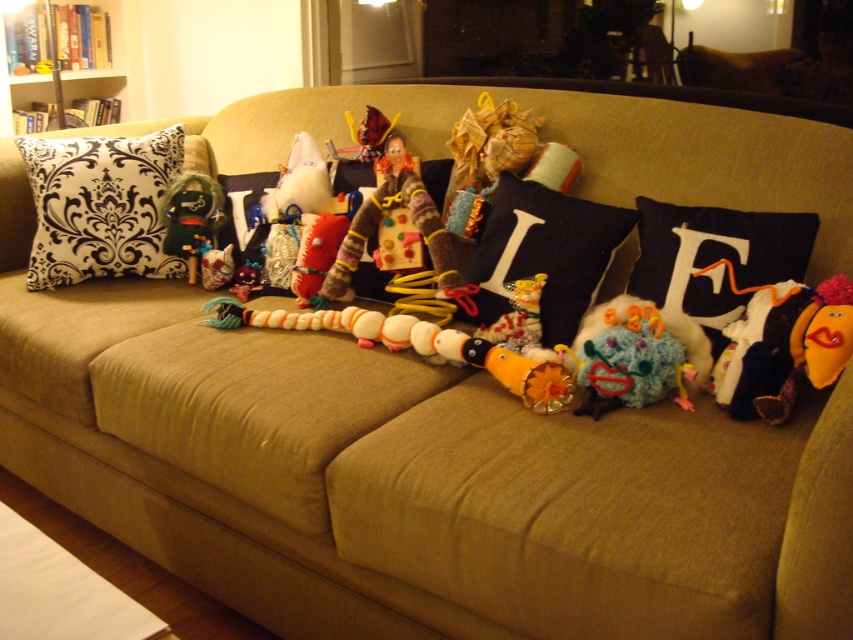
Question: Which point is farther to the camera?

Choices:
 (A) orange plush toy at right
 (B) orange plush toy at center

Answer: (B)

Question: Which object appears farthest from the camera in this image?

Choices:
 (A) knitted multicolored toy at center
 (B) orange plush toy at center
 (C) shiny green plush at center
 (D) black damask pillow at center

Answer: (C)

Question: Is black damask fabric pillow at left thinner than fluffy orange and white toy at center?

Choices:
 (A) yes
 (B) no

Answer: (B)

Question: Can you confirm if black damask fabric pillow at left is positioned below orange plush toy at center?

Choices:
 (A) yes
 (B) no

Answer: (B)

Question: Which of the following is the farthest from the observer?

Choices:
 (A) orange plush toy at right
 (B) orange plush toy at center
 (C) fluffy orange and white toy at center
 (D) black damask fabric pillow at left

Answer: (D)

Question: Does navy blue fabric pillow at center appear over shiny green plush at center?

Choices:
 (A) no
 (B) yes

Answer: (A)